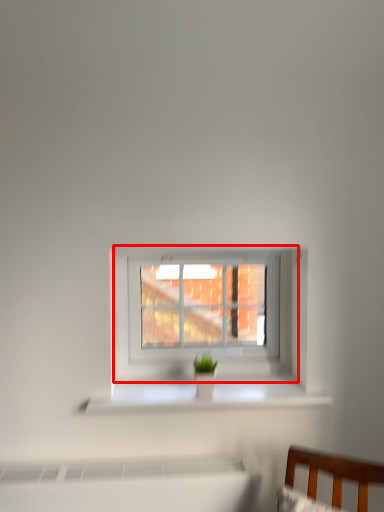
Question: Where is window (annotated by the red box) located in relation to window sill in the image?

Choices:
 (A) left
 (B) right

Answer: (B)